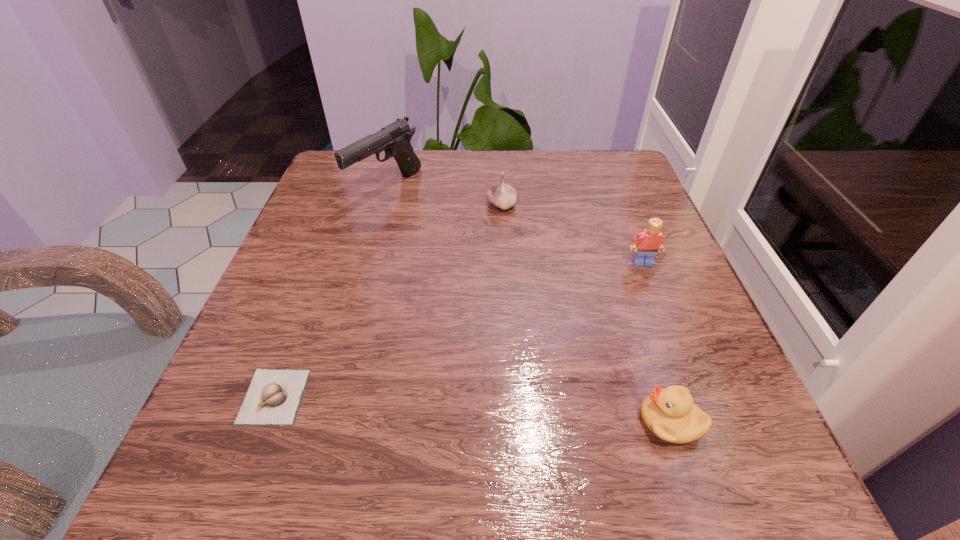
Identify the location of the tallest object. The height and width of the screenshot is (540, 960). (394, 139).

Image resolution: width=960 pixels, height=540 pixels. I want to click on the second tallest object, so click(649, 241).

You are a GUI agent. You are given a task and a screenshot of the screen. Output one action in this format:
    pyautogui.click(x=<x>, y=<y>)
    Task: Click on the Lego
    
    Given the screenshot: What is the action you would take?
    [649, 241]

The width and height of the screenshot is (960, 540). Find the location of `the right garlic`. the right garlic is located at coordinates (502, 195).

The height and width of the screenshot is (540, 960). Identify the location of the third object from right to left. (502, 195).

Where is `the fourth tallest object`? the fourth tallest object is located at coordinates (670, 414).

Image resolution: width=960 pixels, height=540 pixels. I want to click on the nearer garlic, so click(x=273, y=398).

The width and height of the screenshot is (960, 540). In order to click on the shorter garlic in this screenshot , I will do `click(273, 398)`.

Image resolution: width=960 pixels, height=540 pixels. What are the coordinates of `free region located at the muzzle of the gun` in the screenshot? It's located at (336, 369).

Find the location of a particular element. free space located 0.390m on the front-facing side of the Lego is located at coordinates (729, 480).